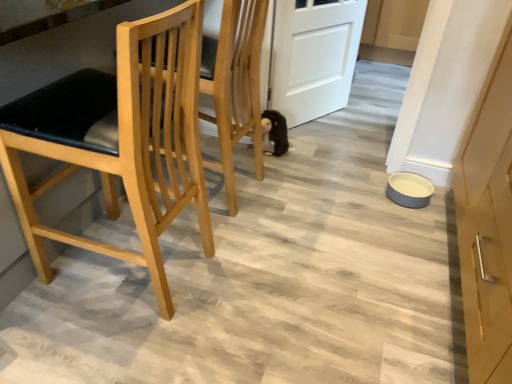
Question: Is black plush toy at center aimed at natural wood chair at left?

Choices:
 (A) yes
 (B) no

Answer: (B)

Question: Is natural wood chair at left inside black plush toy at center?

Choices:
 (A) no
 (B) yes

Answer: (A)

Question: Can we say black plush toy at center lies outside natural wood chair at left?

Choices:
 (A) no
 (B) yes

Answer: (B)

Question: Considering the relative sizes of black plush toy at center and natural wood chair at left in the image provided, is black plush toy at center taller than natural wood chair at left?

Choices:
 (A) no
 (B) yes

Answer: (A)

Question: Is the position of black plush toy at center less distant than that of natural wood chair at left?

Choices:
 (A) no
 (B) yes

Answer: (A)

Question: Is the surface of black plush toy at center in direct contact with natural wood chair at left?

Choices:
 (A) no
 (B) yes

Answer: (A)

Question: Does black plush toy at center have a greater height compared to white matte door at center?

Choices:
 (A) yes
 (B) no

Answer: (B)

Question: Considering the relative positions of black plush toy at center and white matte door at center in the image provided, is black plush toy at center in front of white matte door at center?

Choices:
 (A) yes
 (B) no

Answer: (B)

Question: From the image's perspective, is black plush toy at center on top of white matte door at center?

Choices:
 (A) yes
 (B) no

Answer: (B)

Question: From a real-world perspective, does black plush toy at center sit lower than white matte door at center?

Choices:
 (A) no
 (B) yes

Answer: (B)

Question: Is black plush toy at center looking in the opposite direction of white matte door at center?

Choices:
 (A) no
 (B) yes

Answer: (A)

Question: Can you confirm if black plush toy at center is smaller than white matte door at center?

Choices:
 (A) no
 (B) yes

Answer: (B)

Question: From a real-world perspective, is white matte door at center physically below natural wood chair at left?

Choices:
 (A) no
 (B) yes

Answer: (B)